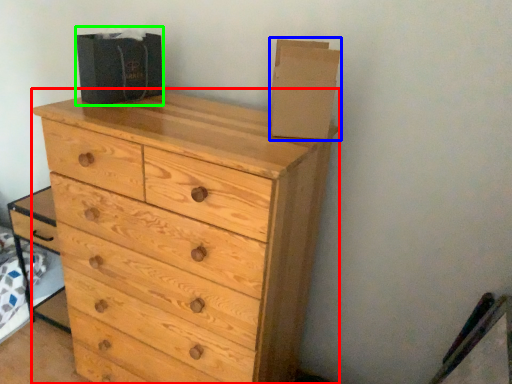
Question: Which object is the farthest from chest of drawers (highlighted by a red box)? Choose among these: cardboard box (highlighted by a blue box) or cardboard box (highlighted by a green box).

Choices:
 (A) cardboard box
 (B) cardboard box

Answer: (B)